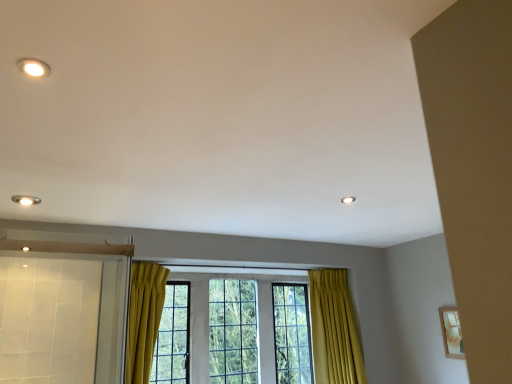
Question: From a real-world perspective, is matte white light fixture at upper left positioned above or below clear glass window at center?

Choices:
 (A) below
 (B) above

Answer: (B)

Question: Looking at their shapes, would you say matte white light fixture at upper left is wider or thinner than clear glass window at center?

Choices:
 (A) thin
 (B) wide

Answer: (A)

Question: Is point (26, 61) closer or farther from the camera than point (348, 329)?

Choices:
 (A) closer
 (B) farther

Answer: (A)

Question: Looking at the image, does clear glass window at center seem bigger or smaller compared to matte white light fixture at upper left?

Choices:
 (A) small
 (B) big

Answer: (B)

Question: From the image's perspective, is clear glass window at center positioned above or below matte white light fixture at upper left?

Choices:
 (A) above
 (B) below

Answer: (B)

Question: Which is correct: clear glass window at center is inside matte white light fixture at upper left, or outside of it?

Choices:
 (A) inside
 (B) outside

Answer: (B)

Question: Is clear glass window at center wider or thinner than matte white light fixture at upper left?

Choices:
 (A) thin
 (B) wide

Answer: (B)